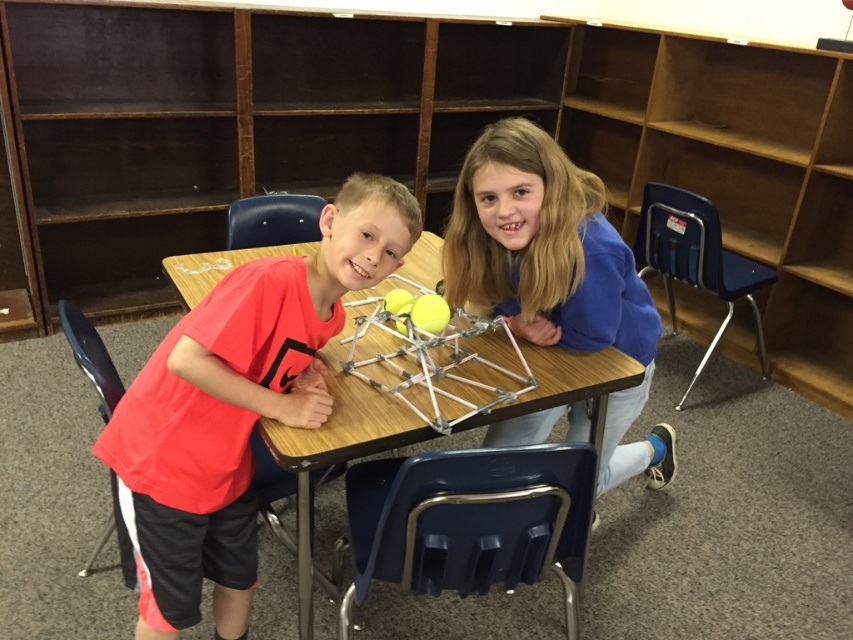
You are a student in the classroom and need to reach the wooden bookshelf at upper center to grab a book. Considering the red matte shirt at center is blocking your view, can you still access the bookshelf?

The wooden bookshelf at upper center is above the red matte shirt at center, so you can still access it since it is positioned higher and not blocked by the shirt.

You are a teacher observing a classroom scene. You notice the red matte shirt at center and the wooden table at center. Which object is positioned lower from the floor?

The red matte shirt at center is below the wooden table at center, so the red matte shirt at center is positioned lower from the floor.